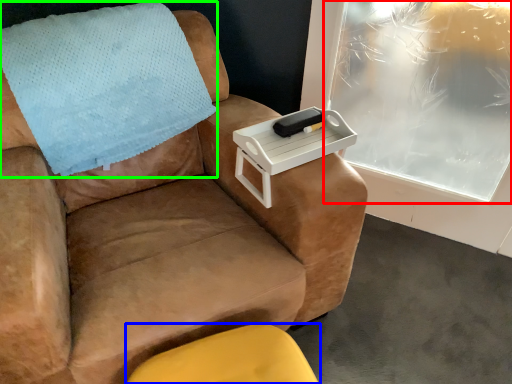
Question: Considering the real-world distances, which object is closest to window screen (highlighted by a red box)? furniture (highlighted by a blue box) or blanket (highlighted by a green box).

Choices:
 (A) furniture
 (B) blanket

Answer: (B)